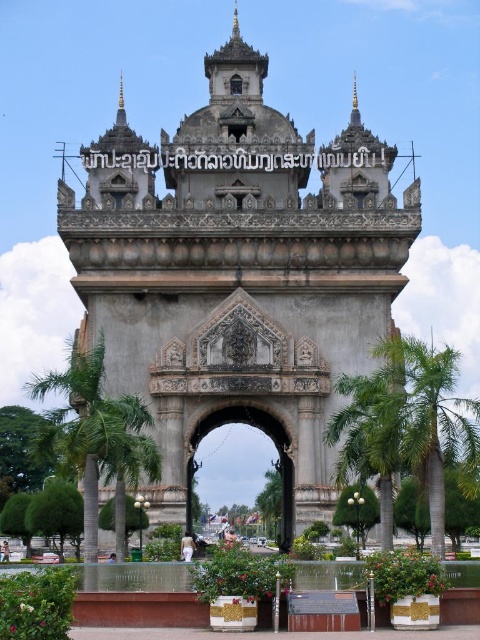
Does green leafy palm tree at center appear on the left side of green leafy palm tree at left?

Incorrect, green leafy palm tree at center is not on the left side of green leafy palm tree at left.

Is green leafy palm tree at center to the right of green leafy palm tree at left from the viewer's perspective?

Correct, you'll find green leafy palm tree at center to the right of green leafy palm tree at left.

Between point (432, 486) and point (35, 392), which one is positioned behind?

The point (35, 392) is more distant.

The image size is (480, 640). I want to click on green leafy palm tree at center, so click(x=408, y=420).

Does gray stone archway at center have a smaller size compared to carved stone archway at center?

Actually, gray stone archway at center might be larger than carved stone archway at center.

Locate an element on the screen. This screenshot has height=640, width=480. gray stone archway at center is located at coordinates (238, 275).

Does point (282, 317) come closer to viewer compared to point (288, 486)?

Yes.

The height and width of the screenshot is (640, 480). Find the location of `gray stone archway at center`. gray stone archway at center is located at coordinates (238, 275).

Is gray stone archway at center closer to camera compared to green leafy palm tree at center?

No, it is behind green leafy palm tree at center.

Is gray stone archway at center positioned at the back of green leafy palm tree at center?

Yes, it is behind green leafy palm tree at center.

Which is behind, point (336, 179) or point (359, 433)?

The point (336, 179) is behind.

The image size is (480, 640). Find the location of `gray stone archway at center`. gray stone archway at center is located at coordinates (238, 275).